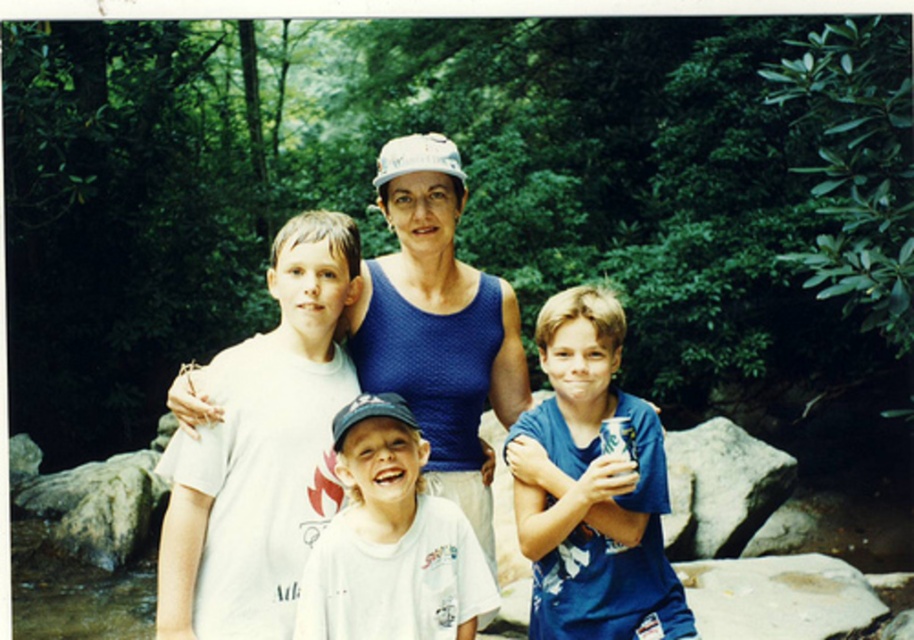
Between point (310, 285) and point (779, 486), which one is positioned behind?

The point (779, 486) is more distant.

Can you confirm if white cotton t-shirt at center is wider than gray rock at right?

No.

Identify the location of white cotton t-shirt at center. (261, 451).

Between white cotton shirt at center and gray rock at right, which one is positioned lower?

gray rock at right is below.

In the scene shown: Can you confirm if white cotton shirt at center is wider than gray rock at right?

Incorrect, white cotton shirt at center's width does not surpass gray rock at right's.

At what (x,y) coordinates should I click in order to perform the action: click on white cotton shirt at center. Please return your answer as a coordinate pair (x, y). The height and width of the screenshot is (640, 914). Looking at the image, I should click on (391, 541).

Which is behind, point (194, 572) or point (444, 531)?

Point (444, 531)

Between white cotton t-shirt at center and white cotton shirt at center, which one is positioned lower?

white cotton shirt at center is lower down.

Where is `white cotton t-shirt at center`? white cotton t-shirt at center is located at coordinates (261, 451).